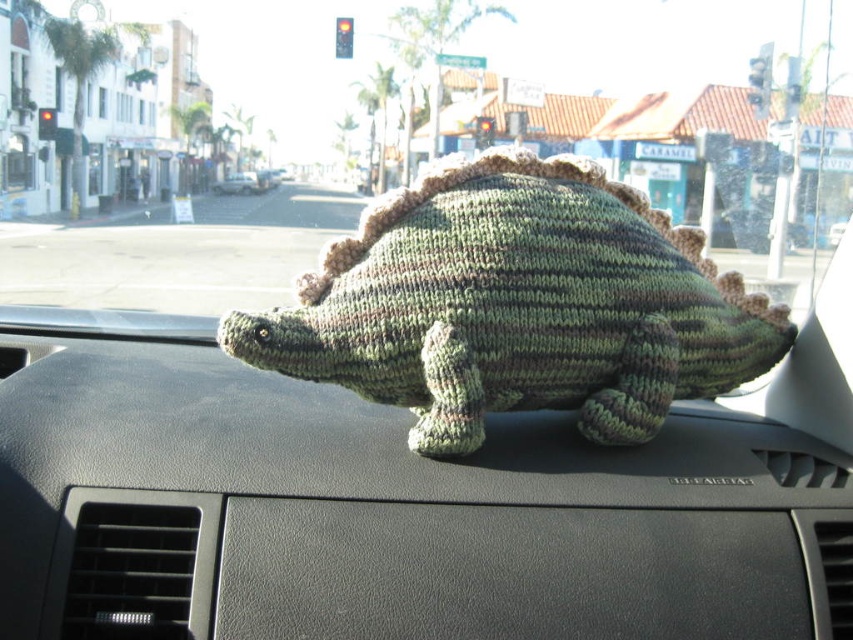
You are a passenger in the car looking at the dashboard. There is a point marked at coordinates (517, 305). What object is located at this point?

The point at coordinates (517, 305) indicates the knitted green dinosaur at center.

You are sitting in the driver seat of the car shown in the image. You notice two points marked on the dashboard. The first point is at coordinates point (x=310, y=308) and the second point is at coordinates point (x=257, y=177). Which point is closer to you as you sit in the driver seat?

Point (x=310, y=308) is closer to the camera than point (x=257, y=177), so the first point is closer to you as you sit in the driver seat.

Based on the photo, you are driving a car and see the knitted green dinosaur at center and the green knitted dinosaur at center on the dashboard. How far apart are these two dinosaurs?

The distance between the knitted green dinosaur at center and the green knitted dinosaur at center is 11.50 meters.